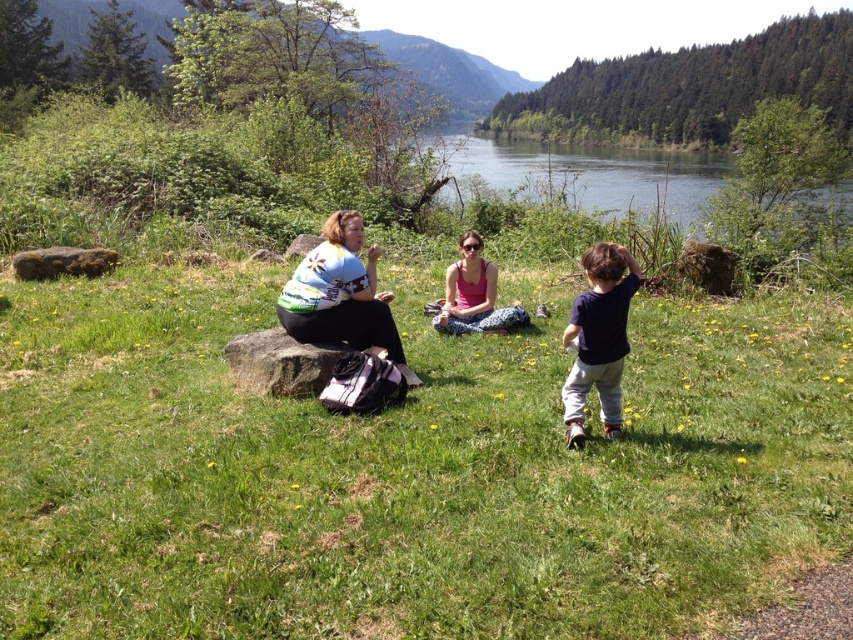
You are standing at point (47, 276) and want to walk to point (560, 186). Which direction should you move relative to the current position?

You should move backward to reach point (560, 186) because it is behind point (47, 276).

You are standing on the grassy bank near the three individuals and want to reach the clear blue water at center. Which direction should you move to get to the water?

The clear blue water at center is located at point (589, 173), so you should move towards the center of the image to reach it.